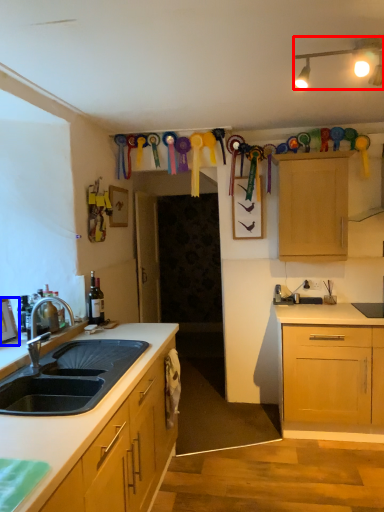
Question: Which point is closer to the camera, lamp (highlighted by a red box) or picture frame (highlighted by a blue box)?

Choices:
 (A) lamp
 (B) picture frame

Answer: (A)